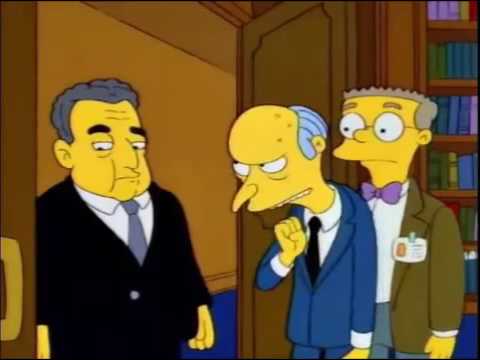
Identify the location of purple book. Image resolution: width=480 pixels, height=360 pixels. (474, 125).